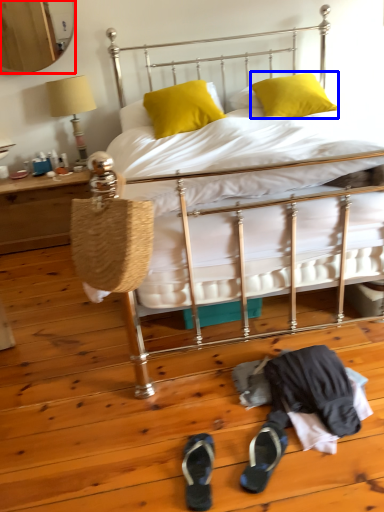
Question: Which object appears closest to the camera in this image, mirror (highlighted by a red box) or pillow (highlighted by a blue box)?

Choices:
 (A) mirror
 (B) pillow

Answer: (B)